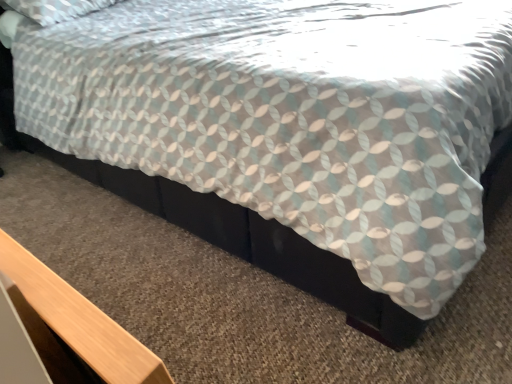
Question: Considering the relative positions of black matte bed frame at lower center and light wood table at lower left in the image provided, is black matte bed frame at lower center to the left or to the right of light wood table at lower left?

Choices:
 (A) left
 (B) right

Answer: (B)

Question: Does point (75, 157) appear closer or farther from the camera than point (26, 269)?

Choices:
 (A) closer
 (B) farther

Answer: (B)

Question: From the image's perspective, is black matte bed frame at lower center above or below light wood table at lower left?

Choices:
 (A) above
 (B) below

Answer: (A)

Question: In the image, is light wood table at lower left positioned in front of or behind black matte bed frame at lower center?

Choices:
 (A) behind
 (B) front

Answer: (B)

Question: Does point (76, 344) appear closer or farther from the camera than point (336, 299)?

Choices:
 (A) farther
 (B) closer

Answer: (B)

Question: From a real-world perspective, is light wood table at lower left positioned above or below black matte bed frame at lower center?

Choices:
 (A) below
 (B) above

Answer: (B)

Question: Considering the positions of light wood table at lower left and black matte bed frame at lower center in the image, is light wood table at lower left taller or shorter than black matte bed frame at lower center?

Choices:
 (A) short
 (B) tall

Answer: (B)